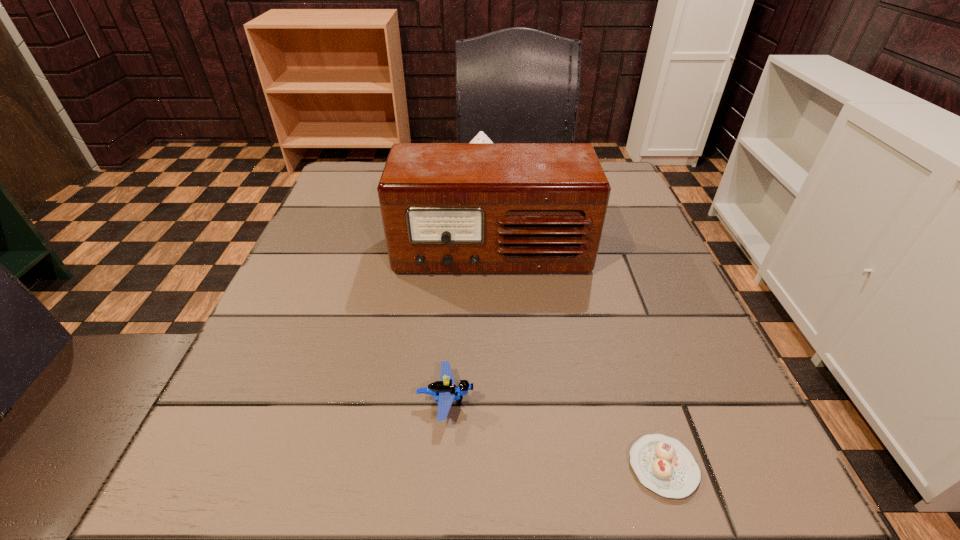
Identify the location of the second closest object relative to the farthest object. This screenshot has width=960, height=540. (445, 391).

Point out which object is positioned as the third nearest to the second nearest object. Please provide its 2D coordinates. Your answer should be formatted as a tuple, i.e. [(x, y)], where the tuple contains the x and y coordinates of a point satisfying the conditions above.

[(480, 137)]

Find the location of a particular element. free space that satisfies the following two spatial constraints: 1. on the front-facing side of the shorter cupcake; 2. on the right side of the second nearest object is located at coordinates (442, 467).

This screenshot has height=540, width=960. In order to click on free space that satisfies the following two spatial constraints: 1. on the front-facing side of the second shortest object; 2. on the left side of the shortest object in this screenshot , I will do [442, 467].

Locate an element on the screen. The image size is (960, 540). vacant point that satisfies the following two spatial constraints: 1. on the front-facing side of the nearer cupcake; 2. on the left side of the Lego is located at coordinates (442, 467).

Find the location of a particular element. The height and width of the screenshot is (540, 960). vacant space that satisfies the following two spatial constraints: 1. on the front-facing side of the tallest object; 2. on the left side of the shortest object is located at coordinates (498, 467).

You are a GUI agent. You are given a task and a screenshot of the screen. Output one action in this format:
    pyautogui.click(x=<x>, y=<y>)
    Task: Click on the free space that satisfies the following two spatial constraints: 1. on the front-facing side of the radio receiver; 2. on the front-facing side of the second nearest object
    This screenshot has height=540, width=960.
    Given the screenshot: What is the action you would take?
    pyautogui.click(x=496, y=401)

At what (x,y) coordinates should I click in order to perform the action: click on vacant space that satisfies the following two spatial constraints: 1. on the front side of the taller cupcake; 2. on the front-facing side of the Lego. Please return your answer as a coordinate pair (x, y). Looking at the image, I should click on (482, 401).

Find the location of a particular element. free space that satisfies the following two spatial constraints: 1. on the front-facing side of the second shortest object; 2. on the right side of the shorter cupcake is located at coordinates coord(442,467).

Where is `free point that satisfies the following two spatial constraints: 1. on the front side of the left cupcake; 2. on the front-facing side of the Lego`? free point that satisfies the following two spatial constraints: 1. on the front side of the left cupcake; 2. on the front-facing side of the Lego is located at coordinates (482, 401).